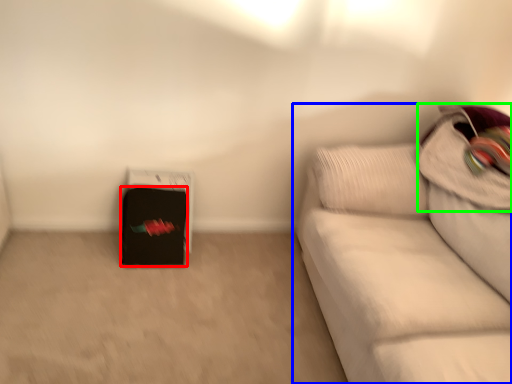
Question: Which is farther away from luggage (highlighted by a red box)? studio couch (highlighted by a blue box) or pillow (highlighted by a green box)?

Choices:
 (A) studio couch
 (B) pillow

Answer: (B)